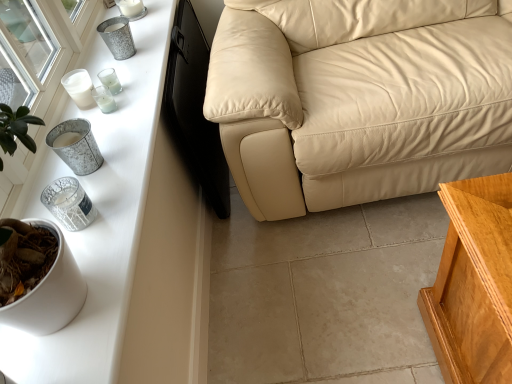
Question: From a real-world perspective, is metallic silver candle holder at left, the second candle holder in the bottom-to-top sequence, over beige leather couch at center?

Choices:
 (A) no
 (B) yes

Answer: (B)

Question: Can beige leather couch at center be found inside metallic silver candle holder at left, which is the 5th candle holder from top to bottom?

Choices:
 (A) yes
 (B) no

Answer: (B)

Question: Is metallic silver candle holder at left, the second candle holder in the bottom-to-top sequence, at the left side of beige leather couch at center?

Choices:
 (A) no
 (B) yes

Answer: (B)

Question: Can you confirm if metallic silver candle holder at left, the second candle holder in the bottom-to-top sequence, is smaller than beige leather couch at center?

Choices:
 (A) yes
 (B) no

Answer: (A)

Question: Considering the relative sizes of metallic silver candle holder at left, which is the 5th candle holder from top to bottom, and beige leather couch at center in the image provided, is metallic silver candle holder at left, which is the 5th candle holder from top to bottom, shorter than beige leather couch at center?

Choices:
 (A) no
 (B) yes

Answer: (B)

Question: Is metallic wire candle holder at left, acting as the sixth candle holder starting from the top, to the left or to the right of beige leather couch at center in the image?

Choices:
 (A) left
 (B) right

Answer: (A)

Question: From a real-world perspective, is metallic wire candle holder at left, which is the 1th candle holder from bottom to top, physically located above or below beige leather couch at center?

Choices:
 (A) above
 (B) below

Answer: (A)

Question: Would you say metallic wire candle holder at left, which is the 1th candle holder from bottom to top, is inside or outside beige leather couch at center?

Choices:
 (A) inside
 (B) outside

Answer: (B)

Question: Considering the positions of metallic wire candle holder at left, which is the 1th candle holder from bottom to top, and beige leather couch at center in the image, is metallic wire candle holder at left, which is the 1th candle holder from bottom to top, wider or thinner than beige leather couch at center?

Choices:
 (A) wide
 (B) thin

Answer: (B)

Question: From a real-world perspective, is metallic wire candle holder at left, which is the 1th candle holder from bottom to top, positioned above or below metallic glass candle at upper left, which appears as the 3th candle holder when ordered from the bottom?

Choices:
 (A) above
 (B) below

Answer: (A)

Question: Looking at the image, does metallic wire candle holder at left, acting as the sixth candle holder starting from the top, seem bigger or smaller compared to metallic glass candle at upper left, which appears as the 3th candle holder when ordered from the bottom?

Choices:
 (A) small
 (B) big

Answer: (B)

Question: Would you say metallic wire candle holder at left, which is the 1th candle holder from bottom to top, is inside or outside metallic glass candle at upper left, the fourth candle holder when ordered from top to bottom?

Choices:
 (A) inside
 (B) outside

Answer: (B)

Question: Is metallic wire candle holder at left, acting as the sixth candle holder starting from the top, wider or thinner than metallic glass candle at upper left, the fourth candle holder when ordered from top to bottom?

Choices:
 (A) wide
 (B) thin

Answer: (A)

Question: Looking at their shapes, would you say metallic glass candle holder at upper left, which is the second candle holder from top to bottom, is wider or thinner than beige leather couch at center?

Choices:
 (A) thin
 (B) wide

Answer: (A)

Question: From the image's perspective, is metallic glass candle holder at upper left, which is the second candle holder from top to bottom, above or below beige leather couch at center?

Choices:
 (A) above
 (B) below

Answer: (B)